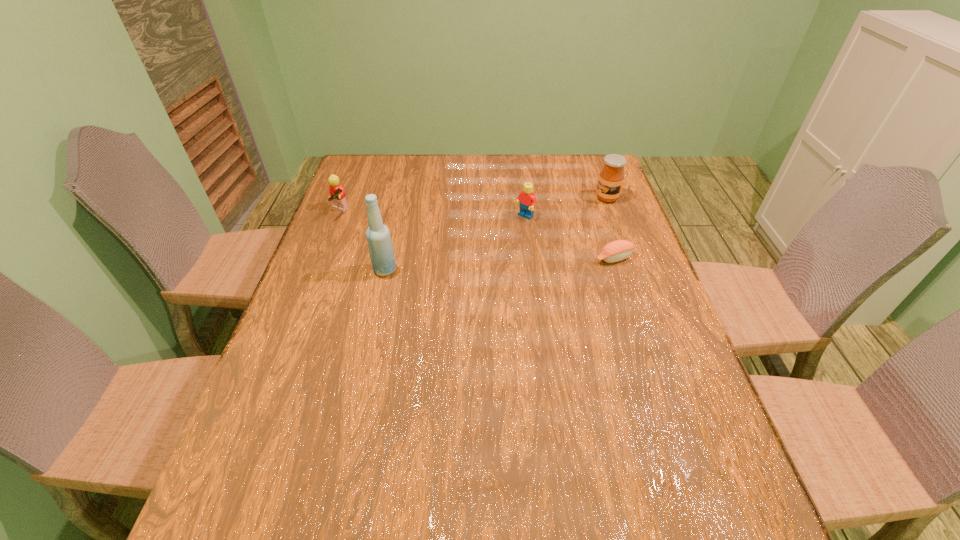
Locate an element on the screen. free spot at the far edge of the desktop is located at coordinates (418, 190).

Locate an element on the screen. The width and height of the screenshot is (960, 540). vacant space at the near edge is located at coordinates (434, 459).

This screenshot has width=960, height=540. In the image, there is a desktop. Identify the location of free space at the left edge. (333, 210).

This screenshot has height=540, width=960. Find the location of `free space at the right edge of the desktop`. free space at the right edge of the desktop is located at coordinates (619, 268).

In the image, there is a desktop. Where is `vacant area at the far left corner`? vacant area at the far left corner is located at coordinates (348, 183).

Identify the location of vacant space at the near left corner. (242, 438).

The width and height of the screenshot is (960, 540). I want to click on free space between the right Lego and the left Lego, so click(432, 214).

Where is `vacant area between the fourth shortest object and the fourth object from right to left`? This screenshot has width=960, height=540. vacant area between the fourth shortest object and the fourth object from right to left is located at coordinates (496, 234).

I want to click on empty location between the right Lego and the bottle, so click(454, 244).

Identify the location of vacant region between the sushi and the third object from right to left. (569, 238).